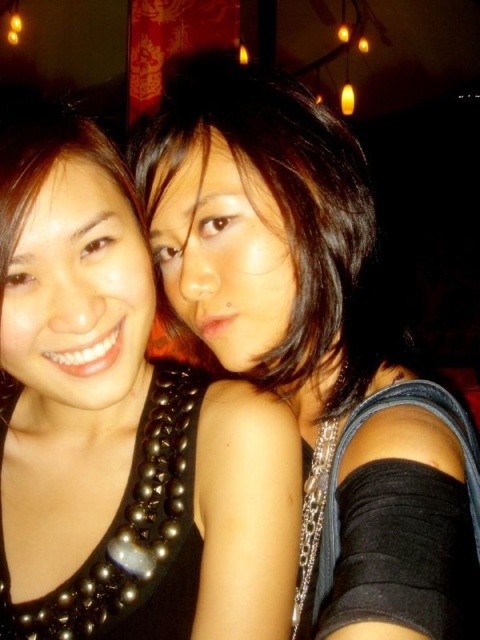
You are a photographer adjusting the camera focus. The black pearl necklace at center and the black beaded necklace at upper left are both in the frame. Can you focus on both necklaces simultaneously if the camera has a depth of field that can cover 5 inches?

The distance between the black pearl necklace at center and the black beaded necklace at upper left is 5.50 inches, which exceeds the camera depth of field of 5 inches. Therefore, you cannot focus on both necklaces simultaneously.

You are a photographer trying to capture a closeup of the black pearl necklace at center and the black beaded necklace at upper left. Which necklace do you need to zoom in more on to ensure it appears larger in the photo?

The black pearl necklace at center has a lesser width compared to the black beaded necklace at upper left, so you should zoom in more on the black pearl necklace at center to make it appear larger in the photo.

You are a photographer adjusting the lighting in a dimly lit indoor space. You need to place a spotlight at point (122,426) to highlight the black pearl necklace at center. However, you must ensure the spotlight does not cast a shadow on any other object in the scene. Given that the two people are standing close to each other, can you confirm if placing the spotlight at that point will avoid casting shadows on them?

The black pearl necklace at center is located at point (122,426). Since the spotlight is placed exactly at the necklace, it will illuminate it directly without casting shadows on the two people standing nearby.